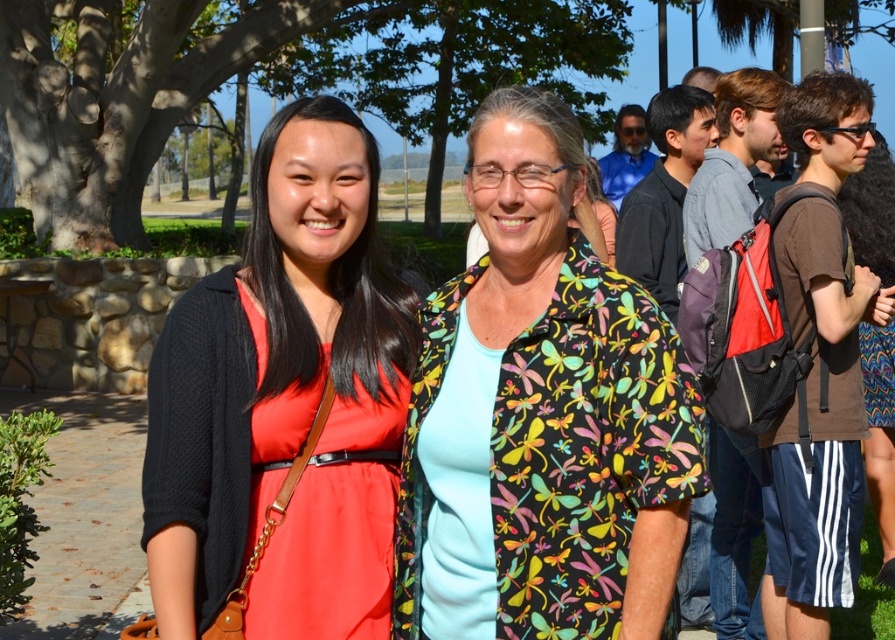
Is multicolored floral shirt at center below matte black cardigan at center?

Incorrect, multicolored floral shirt at center is not positioned below matte black cardigan at center.

Which is behind, point (496, 545) or point (166, 412)?

Point (166, 412)

You are a GUI agent. You are given a task and a screenshot of the screen. Output one action in this format:
    pyautogui.click(x=<x>, y=<y>)
    Task: Click on the multicolored floral shirt at center
    This screenshot has height=640, width=895.
    Given the screenshot: What is the action you would take?
    pyautogui.click(x=546, y=412)

Find the location of a particular element. The image size is (895, 640). multicolored floral shirt at center is located at coordinates (546, 412).